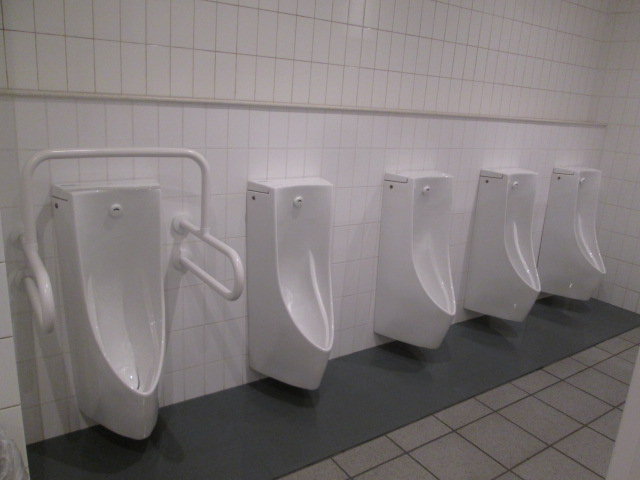
Locate an element on the screen. This screenshot has height=480, width=640. urinals is located at coordinates (111, 287), (285, 261), (412, 250), (508, 244), (572, 235).